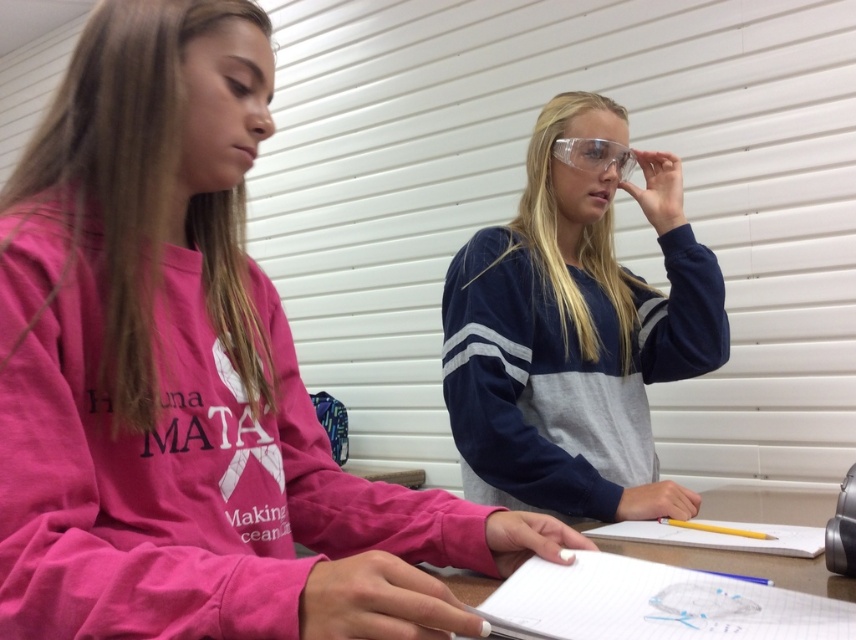
Does white paper at center have a greater width compared to clear plastic goggles at upper center?

Yes, white paper at center is wider than clear plastic goggles at upper center.

Which is more to the left, white paper at center or clear plastic goggles at upper center?

white paper at center

Image resolution: width=856 pixels, height=640 pixels. In order to click on white paper at center in this screenshot , I will do `click(664, 595)`.

Is white paper at center smaller than yellow matte pencil at center?

Actually, white paper at center might be larger than yellow matte pencil at center.

Based on the photo, who is more distant from viewer, [735,561] or [768,536]?

The point [768,536] is behind.

The image size is (856, 640). Identify the location of white paper at center. (664, 595).

In order to click on pink sweatshirt at left in this screenshot , I will do `click(187, 378)`.